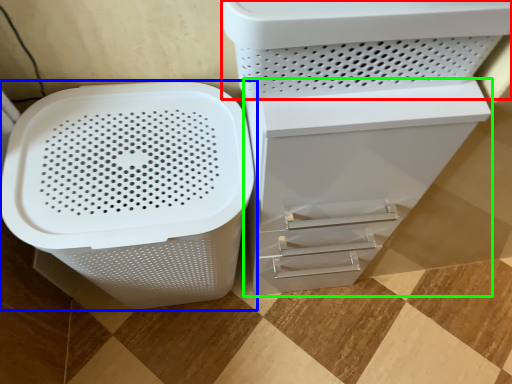
Question: Which object is the closest to the appliance (highlighted by a red box)? Choose among these: waste container (highlighted by a blue box) or file cabinet (highlighted by a green box).

Choices:
 (A) waste container
 (B) file cabinet

Answer: (B)